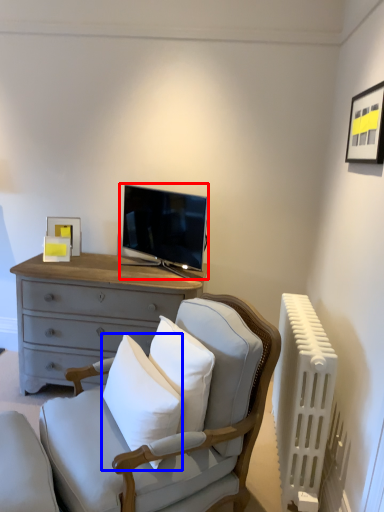
Question: Which object is closer to the camera taking this photo, television (highlighted by a red box) or pillow (highlighted by a blue box)?

Choices:
 (A) television
 (B) pillow

Answer: (B)